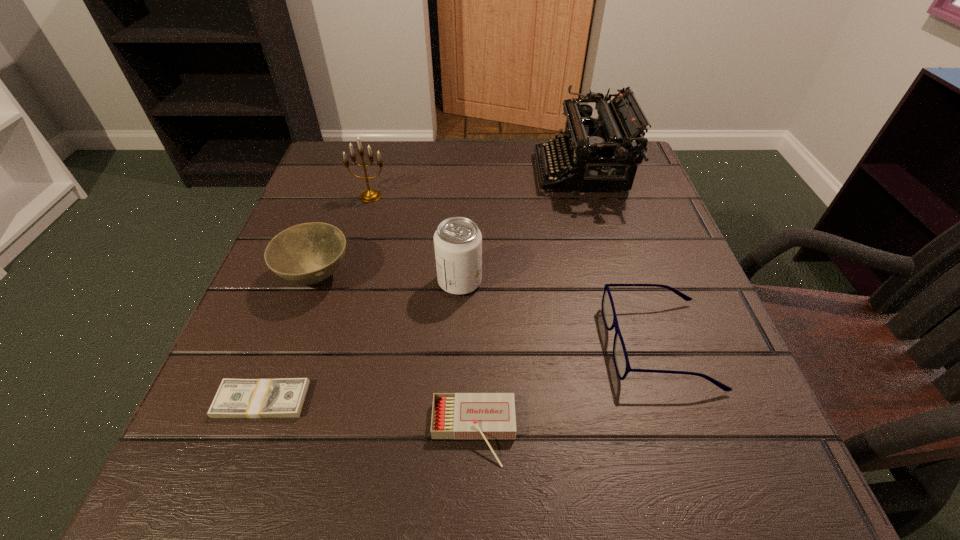
The height and width of the screenshot is (540, 960). What are the coordinates of `vacant region located on the front of the candelabrum` in the screenshot? It's located at (364, 220).

Locate an element on the screen. Image resolution: width=960 pixels, height=540 pixels. free space located 0.240m on the right of the third tallest object is located at coordinates (613, 282).

Locate an element on the screen. blank space located 0.140m on the right of the bowl is located at coordinates (429, 276).

This screenshot has height=540, width=960. I want to click on vacant area situated 0.220m on the front-facing side of the fifth tallest object, so click(x=472, y=345).

Identify the location of vacant space situated 0.080m on the front-facing side of the fifth tallest object. The height and width of the screenshot is (540, 960). click(x=559, y=345).

In order to click on free space located 0.270m on the front-facing side of the fifth tallest object in this screenshot , I will do `click(441, 345)`.

The height and width of the screenshot is (540, 960). I want to click on free space located 0.150m on the right of the shortest object, so click(409, 400).

Find the location of a particular element. This screenshot has width=960, height=540. typewriter that is at the far edge is located at coordinates (600, 153).

Locate an element on the screen. candelabrum that is positioned at the far edge is located at coordinates (370, 195).

What are the coordinates of `object that is at the near edge` in the screenshot? It's located at (485, 416).